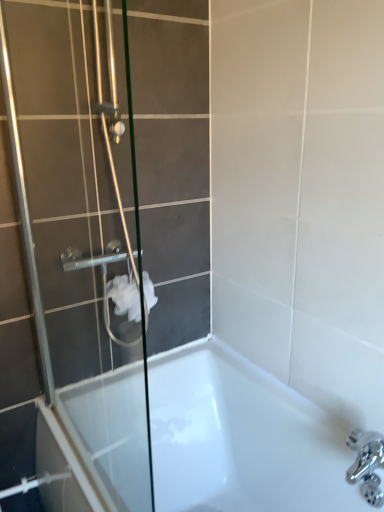
Question: Does white matte toilet paper at center turn towards clear glass shower door at left?

Choices:
 (A) no
 (B) yes

Answer: (A)

Question: Is white matte toilet paper at center closer to camera compared to clear glass shower door at left?

Choices:
 (A) no
 (B) yes

Answer: (A)

Question: From a real-world perspective, is white matte toilet paper at center located beneath clear glass shower door at left?

Choices:
 (A) no
 (B) yes

Answer: (B)

Question: From the image's perspective, is white matte toilet paper at center located above clear glass shower door at left?

Choices:
 (A) yes
 (B) no

Answer: (B)

Question: Does white matte toilet paper at center have a smaller size compared to clear glass shower door at left?

Choices:
 (A) yes
 (B) no

Answer: (A)

Question: Can you confirm if white matte toilet paper at center is bigger than clear glass shower door at left?

Choices:
 (A) yes
 (B) no

Answer: (B)

Question: From the image's perspective, is white glossy bathtub at lower center beneath clear glass shower door at left?

Choices:
 (A) yes
 (B) no

Answer: (A)

Question: Is white glossy bathtub at lower center positioned far away from clear glass shower door at left?

Choices:
 (A) yes
 (B) no

Answer: (B)

Question: From the image's perspective, is white glossy bathtub at lower center above clear glass shower door at left?

Choices:
 (A) no
 (B) yes

Answer: (A)

Question: Is white glossy bathtub at lower center outside of clear glass shower door at left?

Choices:
 (A) no
 (B) yes

Answer: (B)

Question: From a real-world perspective, is white glossy bathtub at lower center located higher than clear glass shower door at left?

Choices:
 (A) no
 (B) yes

Answer: (A)

Question: Is white glossy bathtub at lower center positioned in front of clear glass shower door at left?

Choices:
 (A) yes
 (B) no

Answer: (B)

Question: Is white glossy bathtub at lower center positioned before white matte toilet paper at center?

Choices:
 (A) no
 (B) yes

Answer: (B)